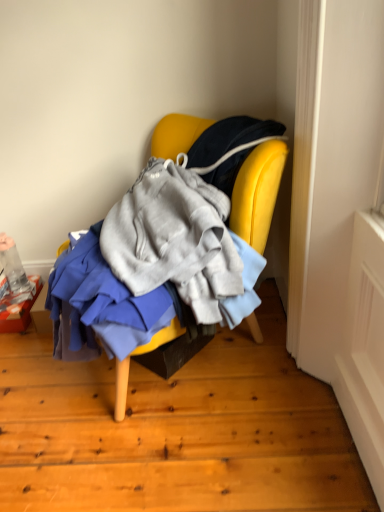
Locate an element on the screen. Image resolution: width=384 pixels, height=512 pixels. yellow fabric chair at center is located at coordinates (258, 192).

This screenshot has height=512, width=384. What do you see at coordinates (258, 192) in the screenshot? I see `yellow fabric chair at center` at bounding box center [258, 192].

The width and height of the screenshot is (384, 512). In order to click on orange cardboard box at lower left in this screenshot , I will do pos(18,309).

Measure the distance between point (9, 332) and camera.

A distance of 5.24 feet exists between point (9, 332) and camera.

What is the approximate height of orange cardboard box at lower left?

orange cardboard box at lower left is 10.04 centimeters tall.

What do you see at coordinates (18, 309) in the screenshot? I see `orange cardboard box at lower left` at bounding box center [18, 309].

The image size is (384, 512). In order to click on yellow fabric chair at center in this screenshot , I will do (258, 192).

Is orange cardboard box at lower left to the right of yellow fabric chair at center from the viewer's perspective?

No.

Is orange cardboard box at lower left positioned in front of yellow fabric chair at center?

No, orange cardboard box at lower left is further to the viewer.

Does point (13, 309) come in front of point (176, 352)?

No, (13, 309) is behind (176, 352).

From the image's perspective, is orange cardboard box at lower left over yellow fabric chair at center?

Incorrect, from the image's perspective, orange cardboard box at lower left is lower than yellow fabric chair at center.

In the scene shown: From a real-world perspective, is orange cardboard box at lower left below yellow fabric chair at center?

Yes, from a real-world perspective, orange cardboard box at lower left is below yellow fabric chair at center.

Does orange cardboard box at lower left have a greater width compared to yellow fabric chair at center?

No, orange cardboard box at lower left is not wider than yellow fabric chair at center.

Does orange cardboard box at lower left have a greater height compared to yellow fabric chair at center?

Incorrect, the height of orange cardboard box at lower left is not larger of that of yellow fabric chair at center.

Which of these two, orange cardboard box at lower left or yellow fabric chair at center, is bigger?

Bigger between the two is yellow fabric chair at center.

Is yellow fabric chair at center inside orange cardboard box at lower left?

Definitely not — yellow fabric chair at center is not inside orange cardboard box at lower left.

Is orange cardboard box at lower left positioned far away from yellow fabric chair at center?

Actually, orange cardboard box at lower left and yellow fabric chair at center are a little close together.

In the scene shown: Is orange cardboard box at lower left facing away from yellow fabric chair at center?

orange cardboard box at lower left is not turned away from yellow fabric chair at center.

How different are the orientations of orange cardboard box at lower left and yellow fabric chair at center in degrees?

There is a 53.6-degree angle between the facing directions of orange cardboard box at lower left and yellow fabric chair at center.

In order to click on box below the yellow fabric chair at center (from the image's perspective) in this screenshot , I will do `click(18, 309)`.

Is yellow fabric chair at center to the left or to the right of orange cardboard box at lower left in the image?

In the image, yellow fabric chair at center appears on the right side of orange cardboard box at lower left.

Looking at this image, considering their positions, is yellow fabric chair at center located in front of or behind orange cardboard box at lower left?

Visually, yellow fabric chair at center is located in front of orange cardboard box at lower left.

Between point (118, 396) and point (26, 316), which one is positioned behind?

The point (26, 316) is more distant.

From the image's perspective, is yellow fabric chair at center located beneath orange cardboard box at lower left?

Incorrect, from the image's perspective, yellow fabric chair at center is higher than orange cardboard box at lower left.

From a real-world perspective, who is located higher, yellow fabric chair at center or orange cardboard box at lower left?

From a 3D spatial view, yellow fabric chair at center is above.

Does yellow fabric chair at center have a lesser width compared to orange cardboard box at lower left?

No, yellow fabric chair at center is not thinner than orange cardboard box at lower left.

Can you confirm if yellow fabric chair at center is taller than orange cardboard box at lower left?

Yes.

Can you confirm if yellow fabric chair at center is bigger than orange cardboard box at lower left?

Yes.

Is yellow fabric chair at center completely or partially outside of orange cardboard box at lower left?

Yes, yellow fabric chair at center is located beyond the bounds of orange cardboard box at lower left.

Is yellow fabric chair at center positioned far away from orange cardboard box at lower left?

They are positioned close to each other.

Is yellow fabric chair at center positioned with its back to orange cardboard box at lower left?

yellow fabric chair at center does not have its back to orange cardboard box at lower left.

This screenshot has width=384, height=512. Find the location of `chair that is in front of the orange cardboard box at lower left`. chair that is in front of the orange cardboard box at lower left is located at coordinates (258, 192).

You are a GUI agent. You are given a task and a screenshot of the screen. Output one action in this format:
    pyautogui.click(x=<x>, y=<y>)
    Task: Click on the box located behind the yellow fabric chair at center
    This screenshot has width=384, height=512.
    Given the screenshot: What is the action you would take?
    pyautogui.click(x=18, y=309)

Where is `box that appears on the left of yellow fabric chair at center`? box that appears on the left of yellow fabric chair at center is located at coordinates (18, 309).